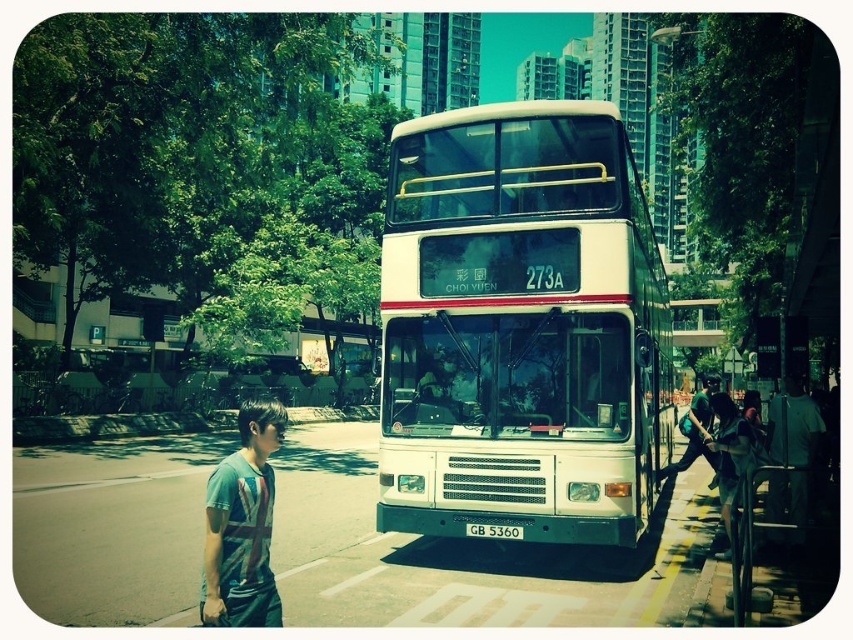
You are standing at the bus stop and want to take a photo of the bus. There are two points marked in the image. One is at coordinate point (621, 522) and the other is at point (215, 468). Which point is closer to you when you are taking the photo?

Point (621, 522) is closer to the camera than point (215, 468).